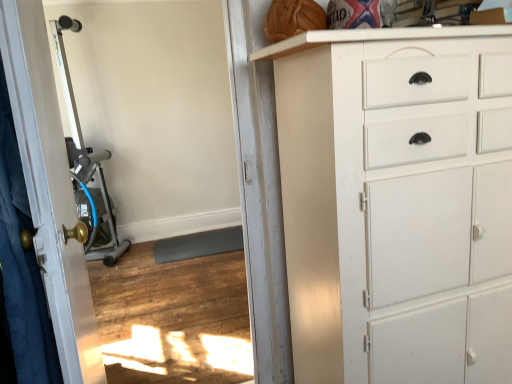
Question: Considering the positions of white painted wood chest of drawers at right and white glossy door at left in the image, is white painted wood chest of drawers at right bigger or smaller than white glossy door at left?

Choices:
 (A) small
 (B) big

Answer: (B)

Question: Which is correct: white painted wood chest of drawers at right is inside white glossy door at left, or outside of it?

Choices:
 (A) inside
 (B) outside

Answer: (B)

Question: Which is nearer to the white painted wood chest of drawers at right?

Choices:
 (A) silver metallic exercise machine at left
 (B) white glossy door at left
 (C) silver metallic exercise machine at left

Answer: (B)

Question: Which of these objects is positioned closest to the white glossy door at left?

Choices:
 (A) white painted wood chest of drawers at right
 (B) silver metallic exercise machine at left
 (C) silver metallic exercise machine at left

Answer: (B)